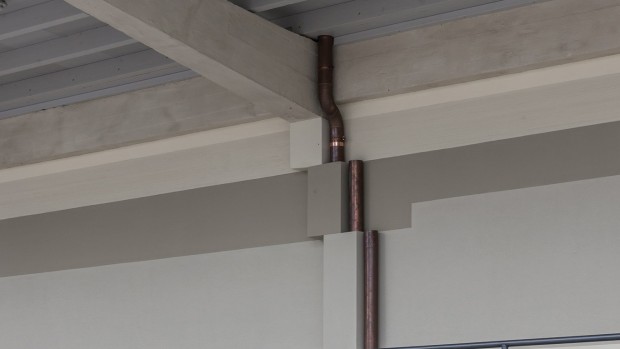
Identify the location of underside of a wood plank. This screenshot has width=620, height=349. (480, 84), (253, 132), (250, 84).